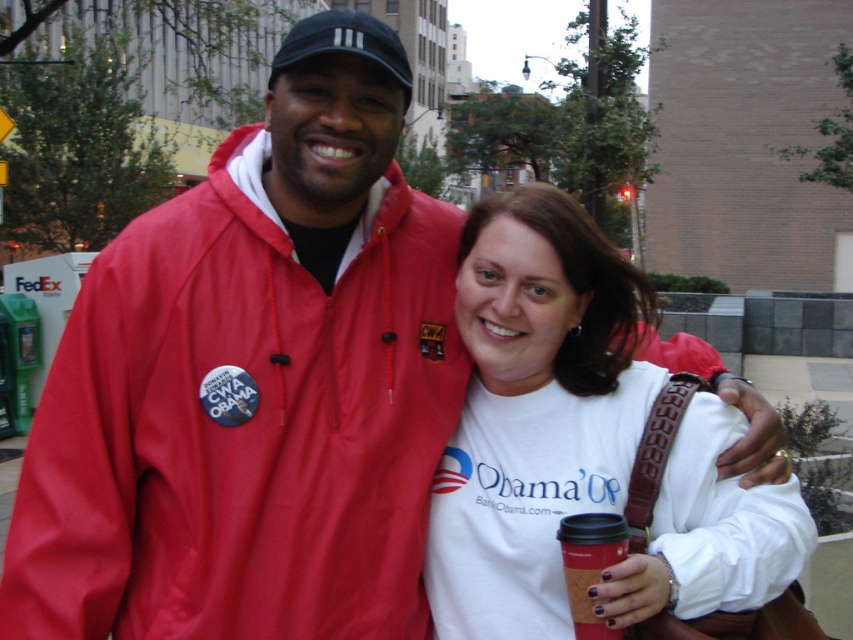
Question: Does matte red jacket at center appear on the right side of white matte t-shirt at center?

Choices:
 (A) no
 (B) yes

Answer: (A)

Question: Estimate the real-world distances between objects in this image. Which object is closer to the matte red jacket at center?

Choices:
 (A) red paper cup at lower center
 (B) white matte t-shirt at center

Answer: (B)

Question: Which point is farther from the camera taking this photo?

Choices:
 (A) (431, 416)
 (B) (579, 612)
 (C) (511, 408)

Answer: (A)

Question: Can you confirm if white matte t-shirt at center is positioned below red paper cup at lower center?

Choices:
 (A) no
 (B) yes

Answer: (A)

Question: Is matte red jacket at center bigger than red paper cup at lower center?

Choices:
 (A) no
 (B) yes

Answer: (B)

Question: Which is farther from the white matte t-shirt at center?

Choices:
 (A) matte red jacket at center
 (B) red paper cup at lower center

Answer: (A)